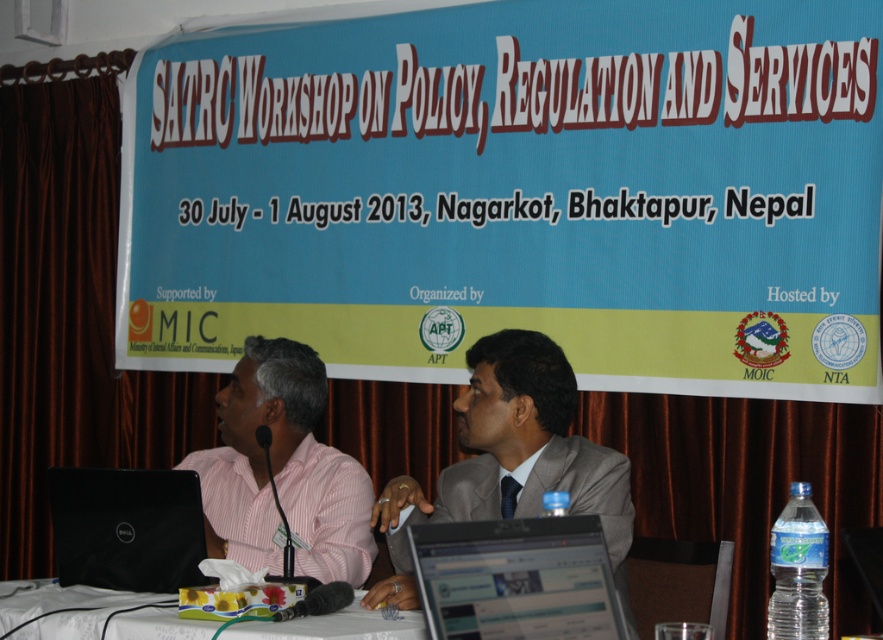
You are attending the SATRO Workshop and need to present your slides. You have a blue fabric banner at upper center and a black matte laptop at left. Which object is taller?

The blue fabric banner at upper center is much taller than the black matte laptop at left.

You are setting up a workspace and need to place the black matte laptop at left on top of the white fabric table at lower center. Can the laptop fit on the table based on their thickness?

The black matte laptop at left is thinner than the white fabric table at lower center, so yes, the laptop can fit on the table since its thickness is less than the table.

You are attending the SATRO Workshop and notice two items on the table. Which item is positioned more to the left between the pink striped shirt at left and the black matte laptop at left?

The black matte laptop at left is positioned more to the left because the pink striped shirt at left is to the right of the black matte laptop at left.